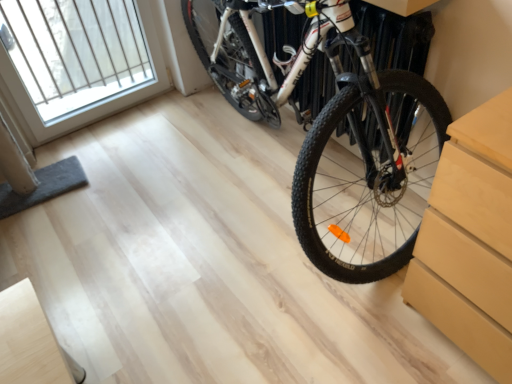
Image resolution: width=512 pixels, height=384 pixels. I want to click on vacant region below shiny white bicycle at center (from a real-world perspective), so click(x=272, y=184).